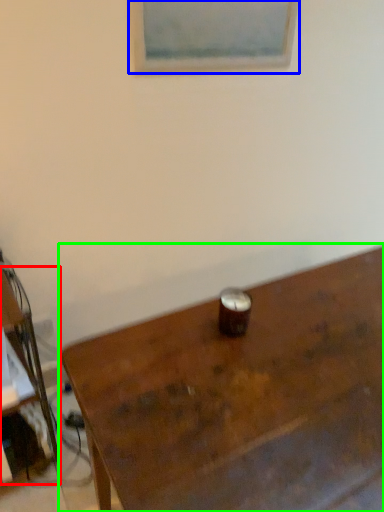
Question: Which is farther away from desk (highlighted by a red box)? picture frame (highlighted by a blue box) or table (highlighted by a green box)?

Choices:
 (A) picture frame
 (B) table

Answer: (A)